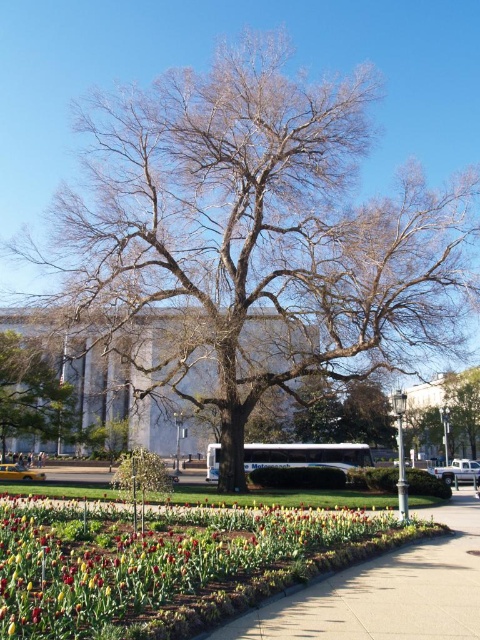
Question: Which object is the closest to the bare wood tree at center?

Choices:
 (A) green leafy tree at center
 (B) vivid multicolored tulips at center

Answer: (A)

Question: Does bare wood tree at center appear under vivid multicolored tulips at center?

Choices:
 (A) no
 (B) yes

Answer: (A)

Question: Considering the relative positions of vivid multicolored tulips at center and green leafy tree at center in the image provided, where is vivid multicolored tulips at center located with respect to green leafy tree at center?

Choices:
 (A) above
 (B) below

Answer: (A)

Question: Which object is farther from the camera taking this photo?

Choices:
 (A) vivid multicolored tulips at center
 (B) green leafy tree at center

Answer: (B)

Question: Which point appears farthest from the camera in this image?

Choices:
 (A) (372, 276)
 (B) (0, 381)

Answer: (B)

Question: Is vivid multicolored tulips at center smaller than green leafy tree at center?

Choices:
 (A) no
 (B) yes

Answer: (B)